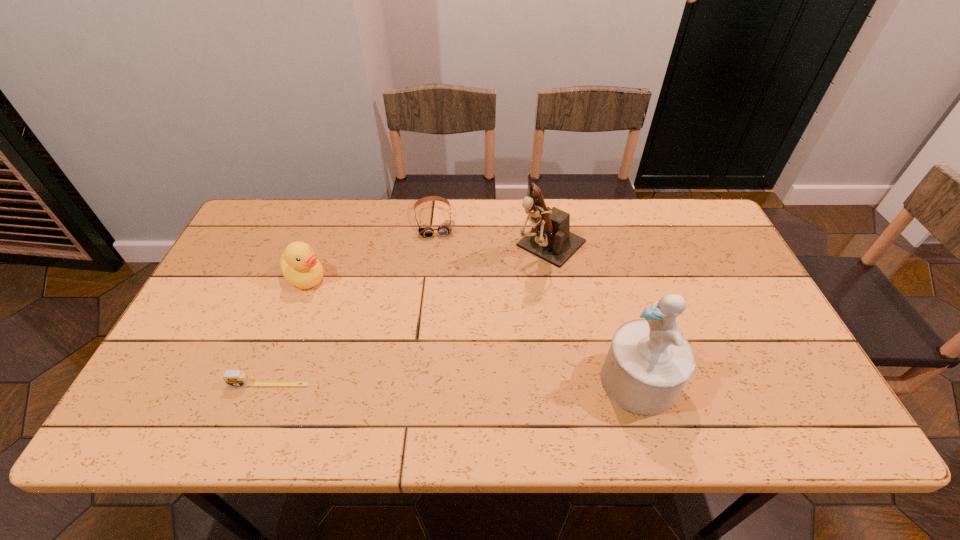
In order to click on vacant spot on the desktop that is between the shortest object and the nearer figurine and is positioned at the beak of the duck in this screenshot , I will do `click(417, 383)`.

This screenshot has width=960, height=540. Identify the location of free space on the desktop that is between the shortest object and the nearer figurine and is positioned on the front-facing side of the farther figurine. (408, 383).

Image resolution: width=960 pixels, height=540 pixels. Find the location of `free space on the desktop that is between the tape measure and the nearer figurine and is positioned on the front-facing side of the third object from right to left`. free space on the desktop that is between the tape measure and the nearer figurine and is positioned on the front-facing side of the third object from right to left is located at coordinates (460, 383).